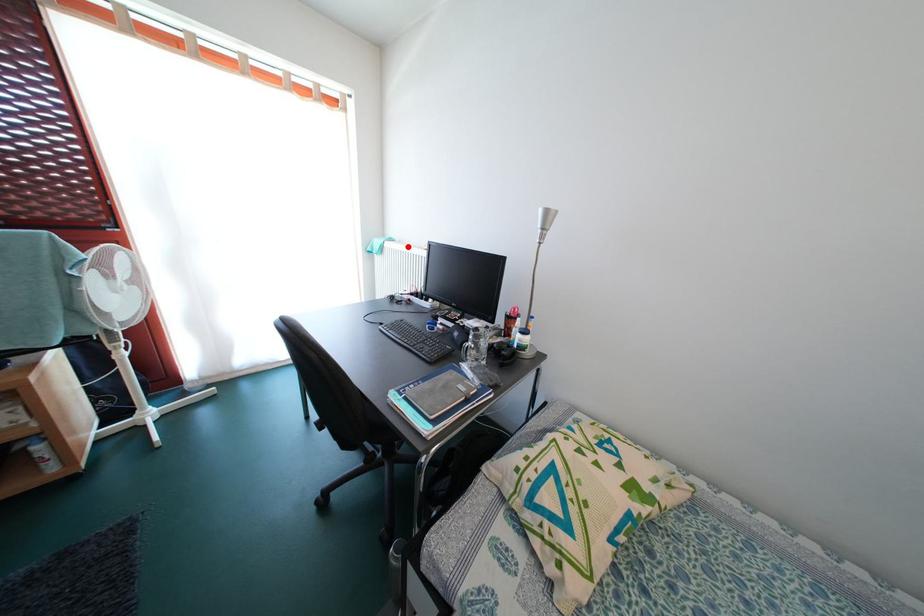
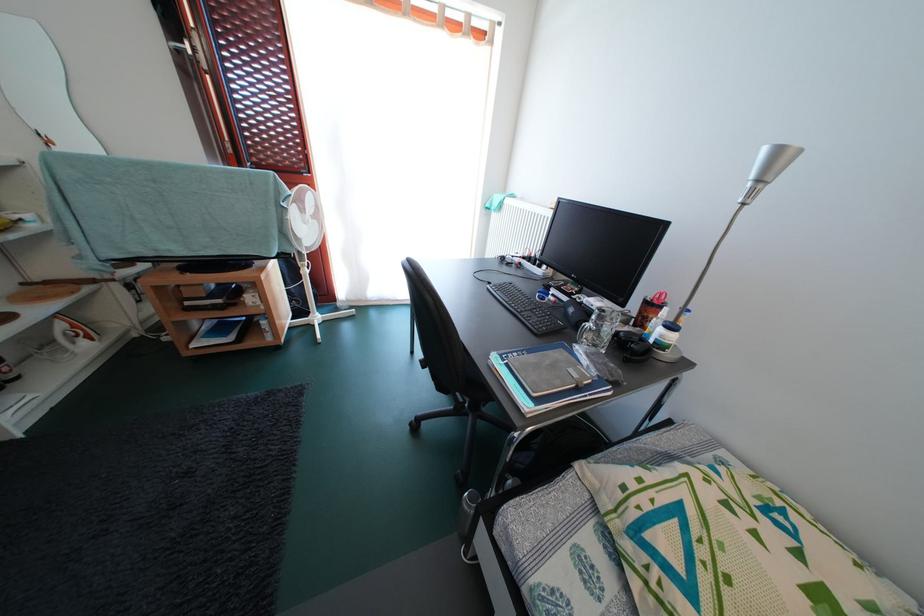
Locate, in the second image, the point that corresponds to the highlighted location in the first image.

(529, 204)